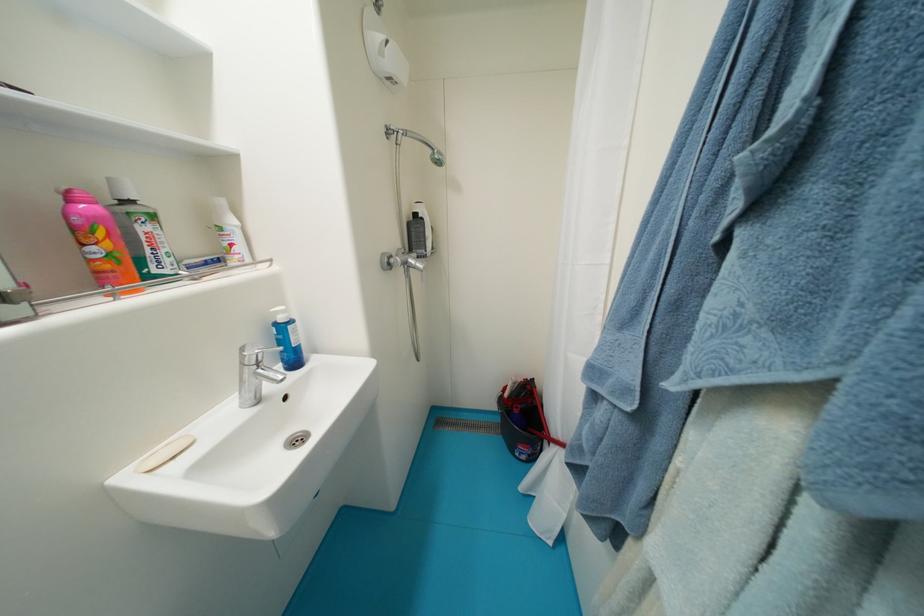
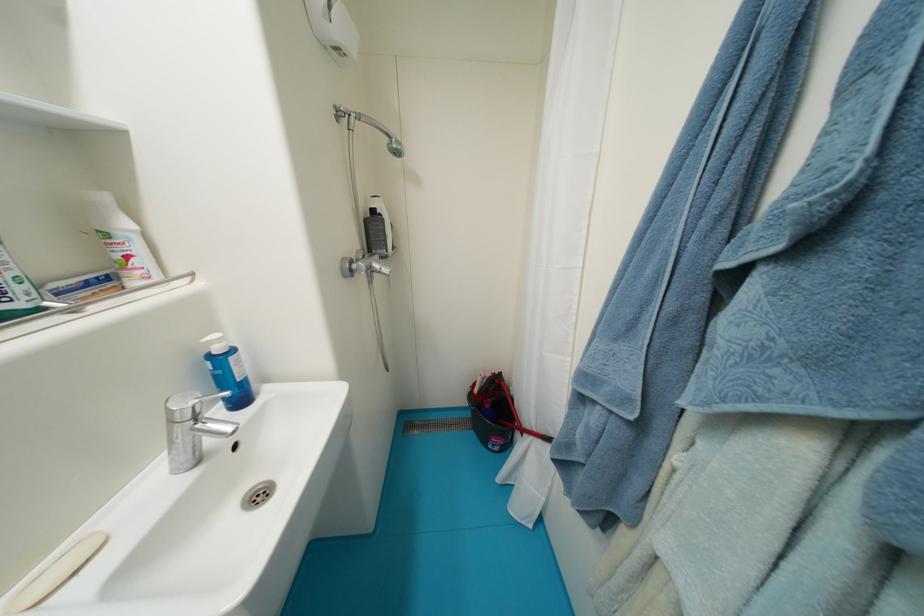
Locate, in the second image, the point that corresponds to the point at 527,381 in the first image.

(495, 377)